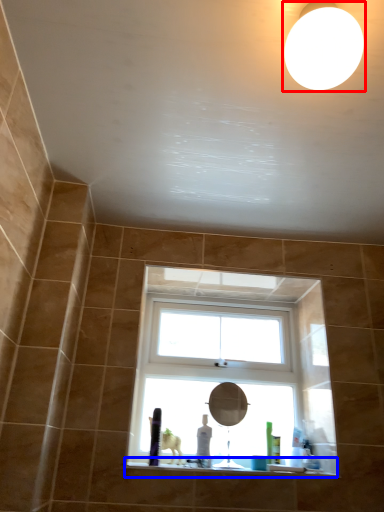
Question: Which point is further to the camera, lighting (highlighted by a red box) or window sill (highlighted by a blue box)?

Choices:
 (A) lighting
 (B) window sill

Answer: (B)